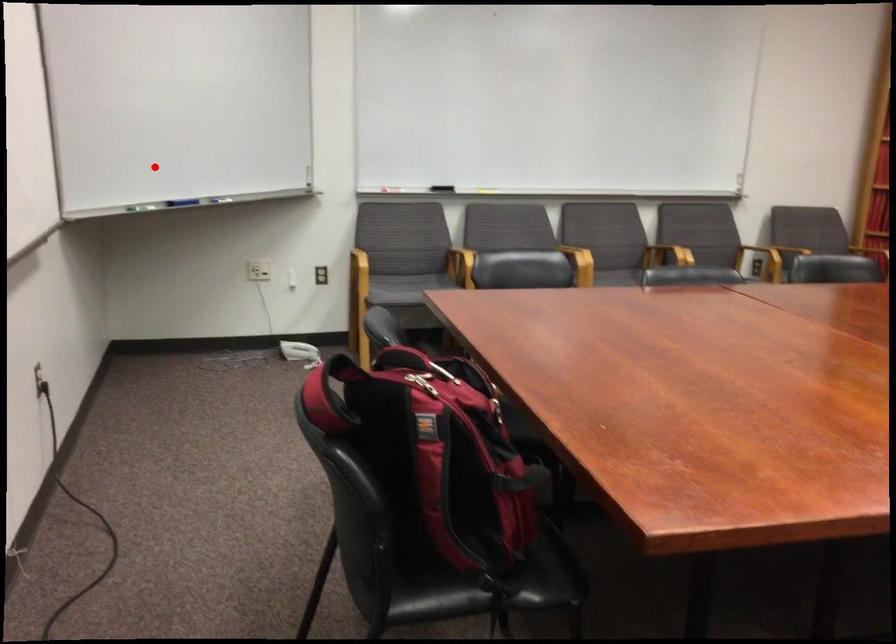
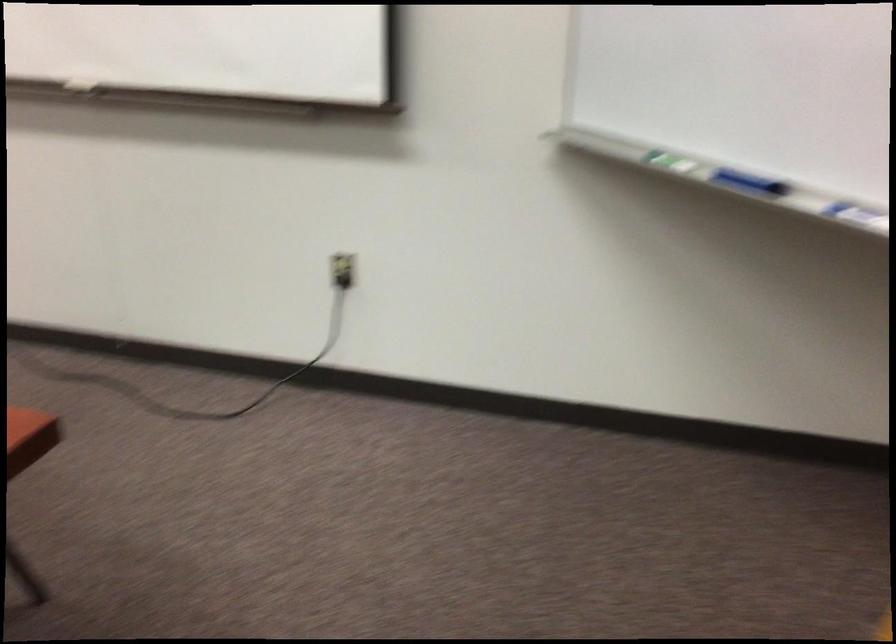
Find the pixel in the second image that matches the highlighted location in the first image.

(748, 182)